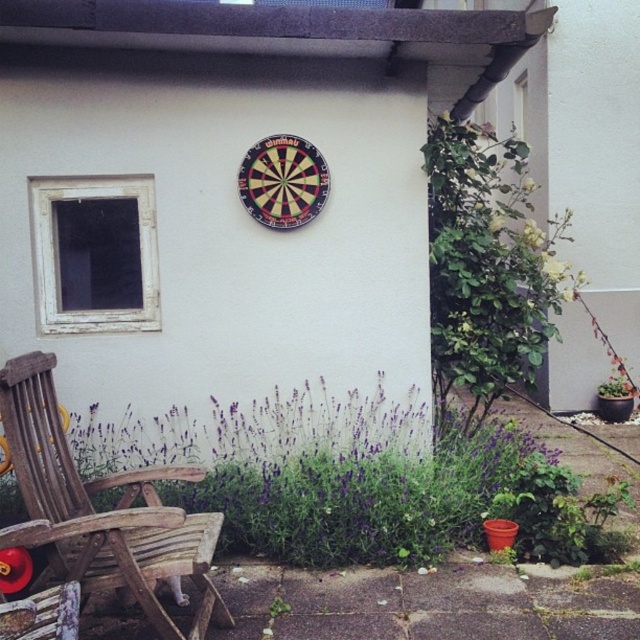
Can you confirm if purple wood lavender at lower center is positioned to the right of wooden rocking chair at lower left?

Indeed, purple wood lavender at lower center is positioned on the right side of wooden rocking chair at lower left.

Does purple wood lavender at lower center have a larger size compared to wooden rocking chair at lower left?

Yes.

Does point (481, 458) come closer to viewer compared to point (140, 474)?

No.

Where is `purple wood lavender at lower center`? purple wood lavender at lower center is located at coordinates (392, 502).